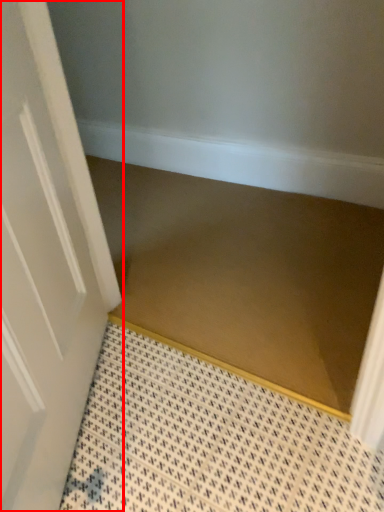
Question: From the image's perspective, where is door (annotated by the red box) located relative to stair?

Choices:
 (A) above
 (B) below

Answer: (B)